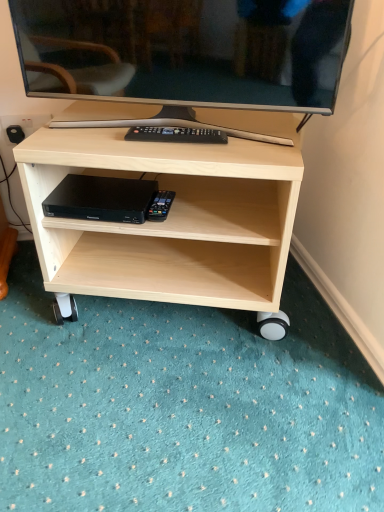
Question: Is the depth of matte black television at upper center greater than that of black plastic dvd player at lower center?

Choices:
 (A) yes
 (B) no

Answer: (B)

Question: Considering the relative sizes of matte black television at upper center and black plastic dvd player at lower center in the image provided, is matte black television at upper center thinner than black plastic dvd player at lower center?

Choices:
 (A) yes
 (B) no

Answer: (A)

Question: From a real-world perspective, is matte black television at upper center physically above black plastic dvd player at lower center?

Choices:
 (A) yes
 (B) no

Answer: (A)

Question: Is the position of matte black television at upper center less distant than that of black plastic dvd player at lower center?

Choices:
 (A) no
 (B) yes

Answer: (B)

Question: Does matte black television at upper center turn towards black plastic dvd player at lower center?

Choices:
 (A) yes
 (B) no

Answer: (B)

Question: Considering the positions of matte black television at upper center and black plastic dvd player at lower center in the image, is matte black television at upper center bigger or smaller than black plastic dvd player at lower center?

Choices:
 (A) small
 (B) big

Answer: (B)

Question: Considering the positions of matte black television at upper center and black plastic dvd player at lower center in the image, is matte black television at upper center wider or thinner than black plastic dvd player at lower center?

Choices:
 (A) thin
 (B) wide

Answer: (A)

Question: Considering the relative positions of matte black television at upper center and black plastic dvd player at lower center in the image provided, is matte black television at upper center to the left or to the right of black plastic dvd player at lower center?

Choices:
 (A) right
 (B) left

Answer: (A)

Question: From a real-world perspective, is matte black television at upper center above or below black plastic dvd player at lower center?

Choices:
 (A) above
 (B) below

Answer: (A)

Question: From the image's perspective, is matte black television at upper center above or below light wood shelf at center?

Choices:
 (A) above
 (B) below

Answer: (A)

Question: Relative to light wood shelf at center, is matte black television at upper center in front or behind?

Choices:
 (A) front
 (B) behind

Answer: (A)

Question: In terms of size, does matte black television at upper center appear bigger or smaller than light wood shelf at center?

Choices:
 (A) big
 (B) small

Answer: (B)

Question: Would you say matte black television at upper center is to the left or to the right of light wood shelf at center in the picture?

Choices:
 (A) right
 (B) left

Answer: (B)

Question: Do you think black plastic dvd player at lower center is within matte black television at upper center, or outside of it?

Choices:
 (A) outside
 (B) inside

Answer: (A)

Question: From the image's perspective, is black plastic dvd player at lower center positioned above or below matte black television at upper center?

Choices:
 (A) below
 (B) above

Answer: (A)